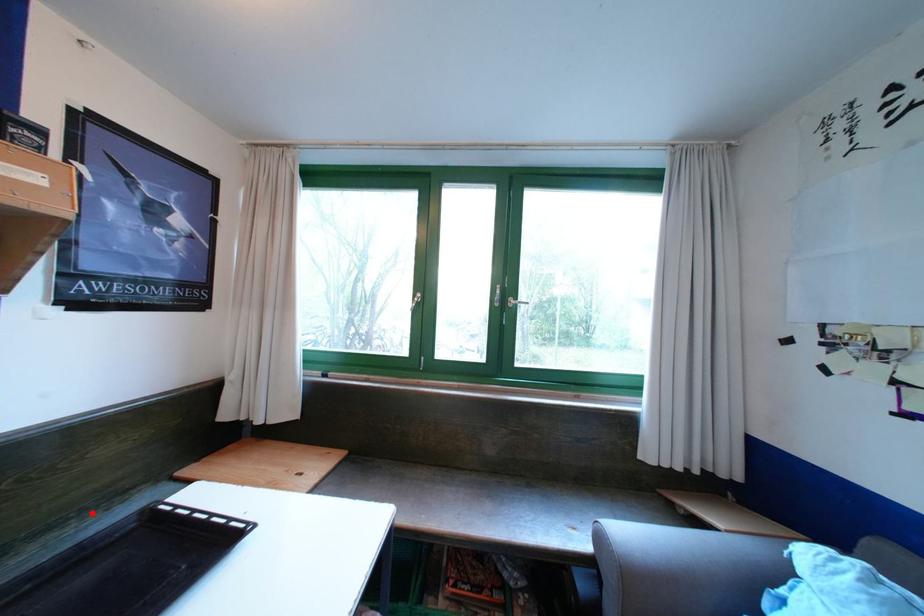
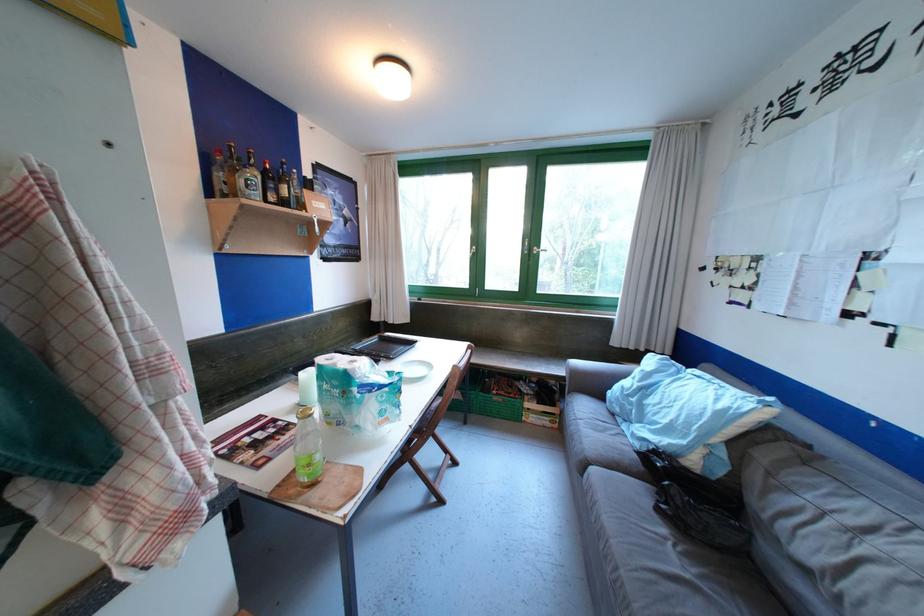
Question: I am providing you with two images of the same scene from different viewpoints. Given a red point in image1, look at the same physical point in image2. Is it:

Choices:
 (A) Closer to the viewpoint
 (B) Farther from the viewpoint

Answer: (B)